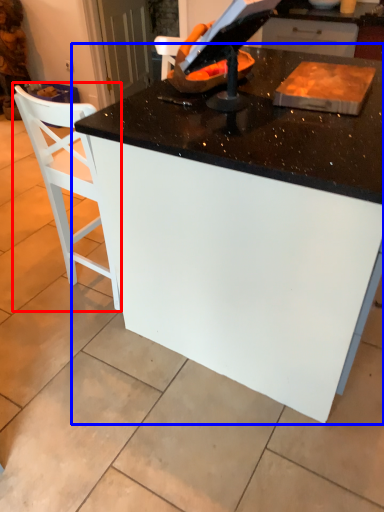
Question: Among these objects, which one is farthest to the camera, chair (highlighted by a red box) or table (highlighted by a blue box)?

Choices:
 (A) chair
 (B) table

Answer: (A)